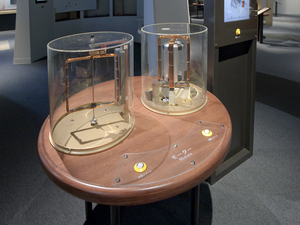
Where is `desk`? This screenshot has width=300, height=225. desk is located at coordinates (9, 26).